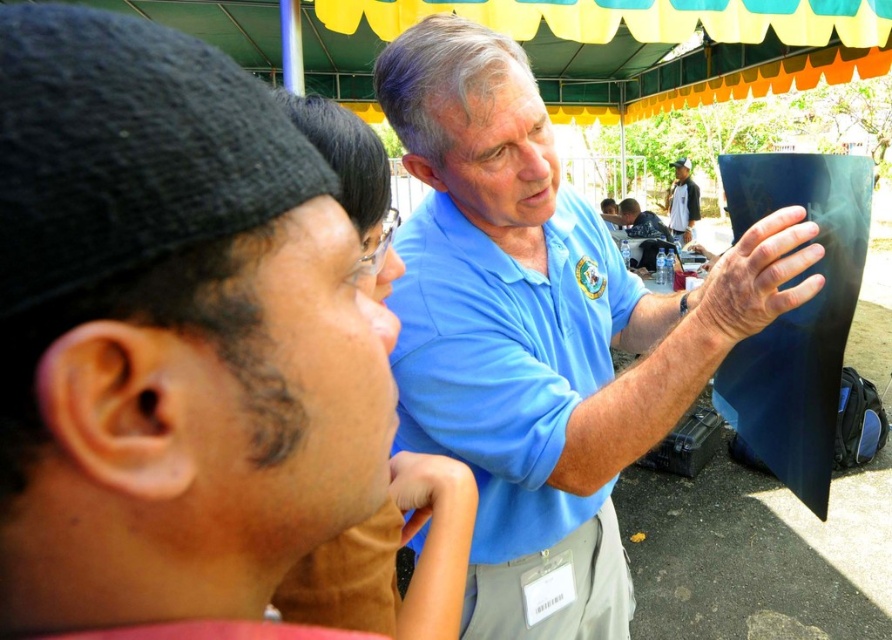
Can you confirm if blue matte shirt at upper center is positioned to the right of white cotton shirt at upper center?

No, blue matte shirt at upper center is not to the right of white cotton shirt at upper center.

You are a GUI agent. You are given a task and a screenshot of the screen. Output one action in this format:
    pyautogui.click(x=<x>, y=<y>)
    Task: Click on the blue matte shirt at upper center
    The width and height of the screenshot is (892, 640).
    Given the screenshot: What is the action you would take?
    click(167, 333)

Identify the location of blue matte shirt at upper center. This screenshot has width=892, height=640. (167, 333).

In the scene shown: Is blue matte shirt at center below blue cotton polo shirt at center?

Yes.

The width and height of the screenshot is (892, 640). Identify the location of blue matte shirt at center. (542, 332).

Between point (672, 189) and point (645, 234), which one is positioned in front?

Point (645, 234) is more forward.

Is the position of white cotton shirt at upper center less distant than that of matte blue shirt at center?

No, it is behind matte blue shirt at center.

Which is in front, point (680, 170) or point (634, 224)?

Positioned in front is point (634, 224).

Where is `white cotton shirt at upper center`? This screenshot has width=892, height=640. white cotton shirt at upper center is located at coordinates (682, 202).